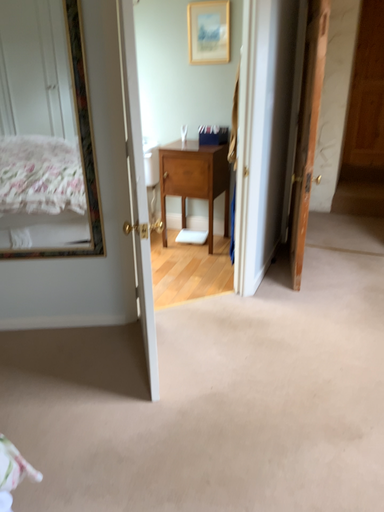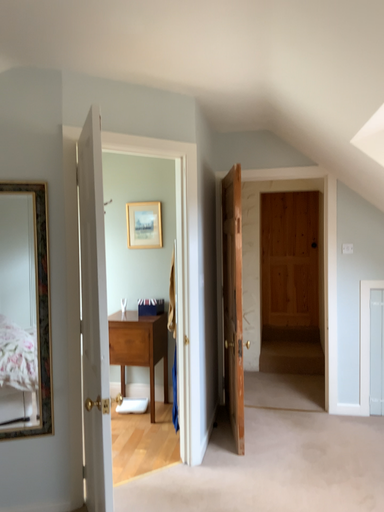
Question: Which way did the camera rotate in the video?

Choices:
 (A) rotated right
 (B) rotated left

Answer: (A)